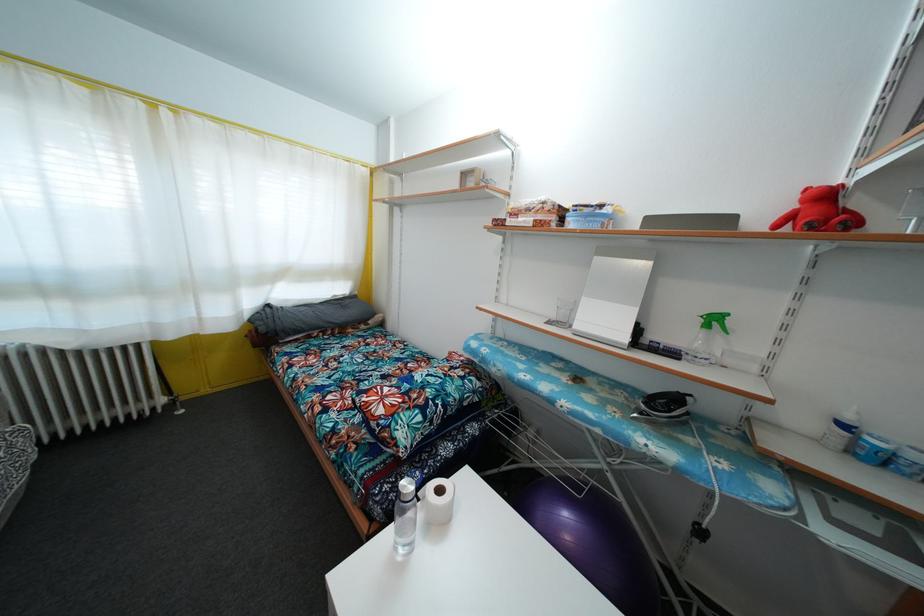
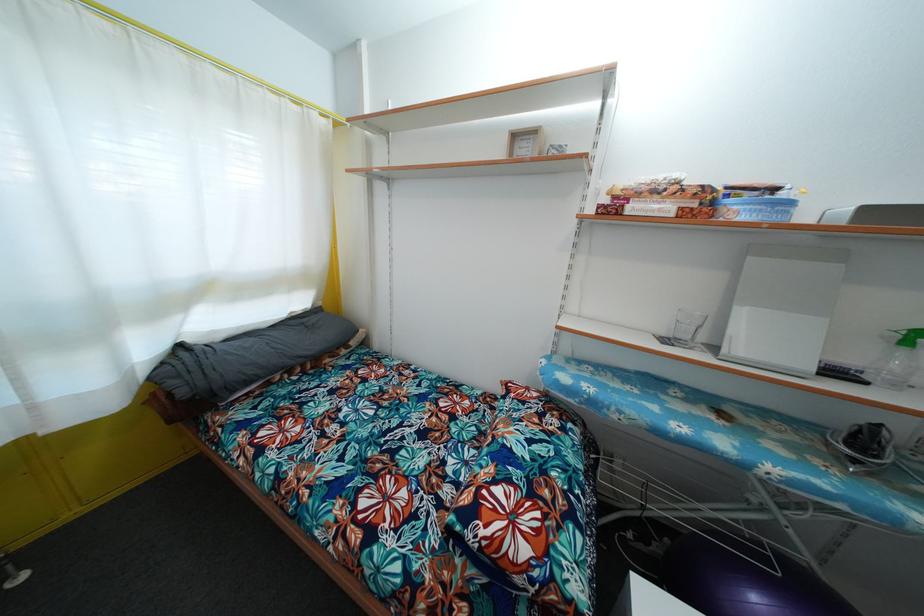
Which direction would the cameraman need to move to produce the second image?

The movement direction of the cameraman is left, forward.